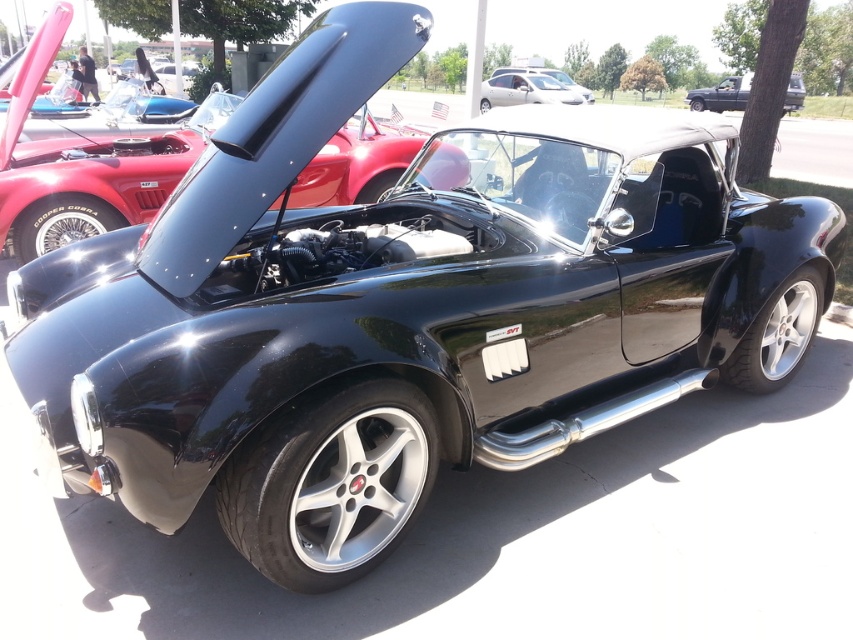
You are a photographer positioned at the bottom of the image. You need to capture both the satin silver car at upper center and the matte black car at upper right in a single shot. Which car will appear higher in the frame?

The satin silver car at upper center will appear higher in the frame since it is located above the matte black car at upper right.

Consider the image. You are standing in front of the classic black Shelby Cobra sports car with the hood open. You want to know if you can reach a point located at coordinates point (479, 99) on the car without moving closer than 40 feet. Can you do it?

The point (479, 99) is 44.72 feet away from the camera, so you cannot reach it without moving closer than 40 feet because the distance is greater than the required minimum distance.

You are standing behind the classic black Shelby Cobra sports car and want to locate two specific points on its body. The first point is at coordinates point (560, 88) and the second is at point (692, 93). Which point is closer to you?

Point (692, 93) is closer to you because it is behind point (560, 88).